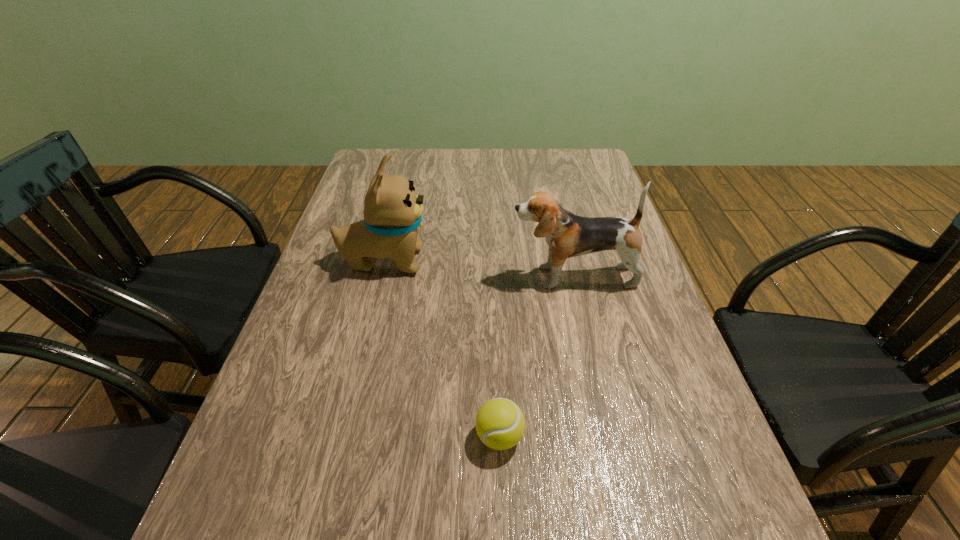
You are a GUI agent. You are given a task and a screenshot of the screen. Output one action in this format:
    pyautogui.click(x=<x>, y=<y>)
    Task: Click on the free spot that satisfies the following two spatial constraints: 1. on the face of the leftmost object; 2. on the right side of the nearest object
    This screenshot has width=960, height=540.
    Given the screenshot: What is the action you would take?
    pyautogui.click(x=340, y=436)

The image size is (960, 540). Find the location of `free space that satisfies the following two spatial constraints: 1. on the face of the leftmost object; 2. on the back side of the shortest object`. free space that satisfies the following two spatial constraints: 1. on the face of the leftmost object; 2. on the back side of the shortest object is located at coordinates (340, 436).

You are a GUI agent. You are given a task and a screenshot of the screen. Output one action in this format:
    pyautogui.click(x=<x>, y=<y>)
    Task: Click on the vacant space that satisfies the following two spatial constraints: 1. on the face of the leftmost object; 2. on the right side of the nearest object
    The image size is (960, 540).
    Given the screenshot: What is the action you would take?
    [340, 436]

You are a GUI agent. You are given a task and a screenshot of the screen. Output one action in this format:
    pyautogui.click(x=<x>, y=<y>)
    Task: Click on the vacant region that satisfies the following two spatial constraints: 1. on the face of the tennis ball; 2. on the left side of the left puppy
    The width and height of the screenshot is (960, 540).
    Given the screenshot: What is the action you would take?
    pyautogui.click(x=340, y=436)

Where is `free space that satisfies the following two spatial constraints: 1. at the face of the right puppy; 2. on the front side of the tennis ball`? free space that satisfies the following two spatial constraints: 1. at the face of the right puppy; 2. on the front side of the tennis ball is located at coordinates (611, 436).

Find the location of a particular element. This screenshot has width=960, height=540. vacant point that satisfies the following two spatial constraints: 1. on the face of the leftmost object; 2. on the back side of the shortest object is located at coordinates (340, 436).

I want to click on vacant space that satisfies the following two spatial constraints: 1. on the face of the left puppy; 2. on the left side of the tennis ball, so click(x=340, y=436).

You are a GUI agent. You are given a task and a screenshot of the screen. Output one action in this format:
    pyautogui.click(x=<x>, y=<y>)
    Task: Click on the blank space that satisfies the following two spatial constraints: 1. on the face of the left puppy; 2. on the right side of the tennis ball
    
    Given the screenshot: What is the action you would take?
    pyautogui.click(x=340, y=436)